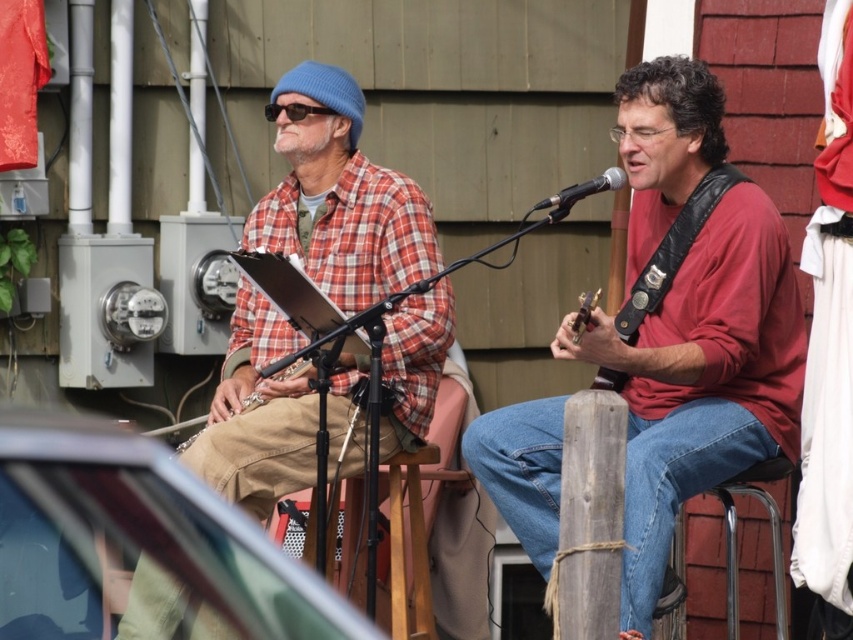
Question: Is matte red shirt at center to the right of plaid flannel shirt at left from the viewer's perspective?

Choices:
 (A) yes
 (B) no

Answer: (A)

Question: Estimate the real-world distances between objects in this image. Which object is closer to the black metallic microphone at center?

Choices:
 (A) wooden stool at center
 (B) matte red shirt at center
 (C) wooden acoustic guitar at center

Answer: (C)

Question: Considering the real-world distances, which object is closest to the plaid flannel shirt at left?

Choices:
 (A) black metallic microphone at center
 (B) wooden stool at center
 (C) matte red shirt at center

Answer: (B)

Question: Can you confirm if matte red shirt at center is positioned to the left of plaid flannel shirt at left?

Choices:
 (A) no
 (B) yes

Answer: (A)

Question: Which of the following is the farthest from the observer?

Choices:
 (A) wooden acoustic guitar at center
 (B) wooden stool at center
 (C) plaid flannel shirt at left

Answer: (B)

Question: Considering the relative positions of matte red shirt at center and wooden acoustic guitar at center in the image provided, where is matte red shirt at center located with respect to wooden acoustic guitar at center?

Choices:
 (A) right
 (B) left

Answer: (A)